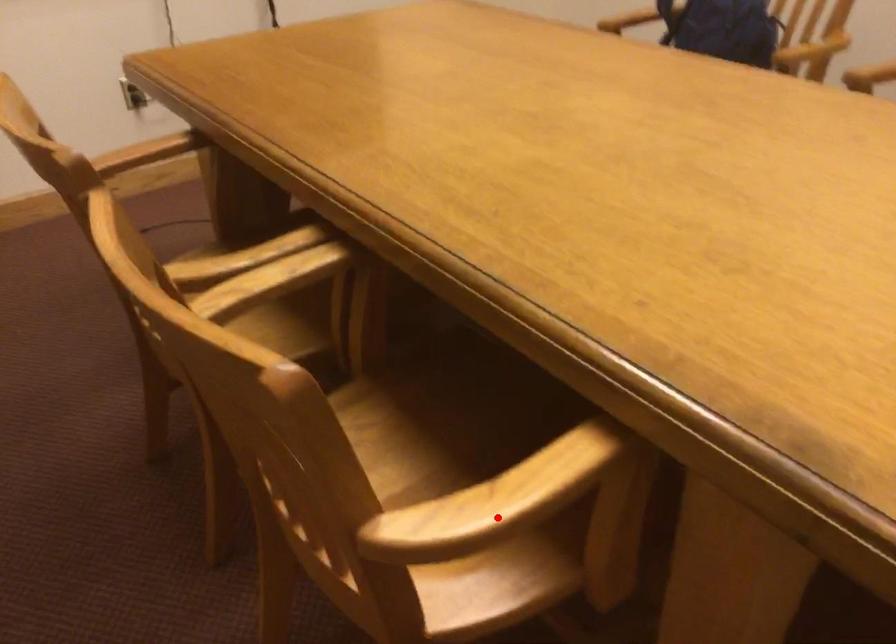
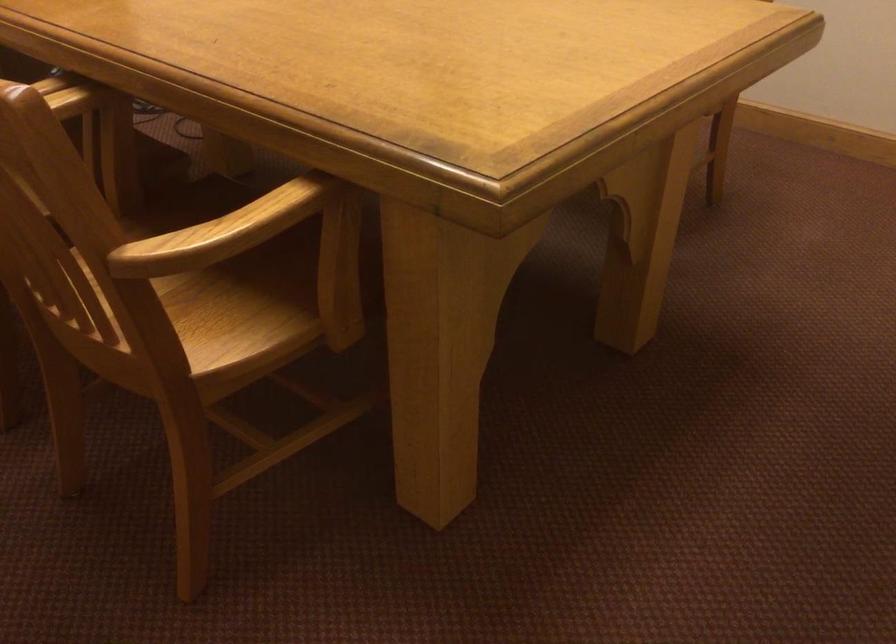
Find the pixel in the second image that matches the highlighted location in the first image.

(221, 232)